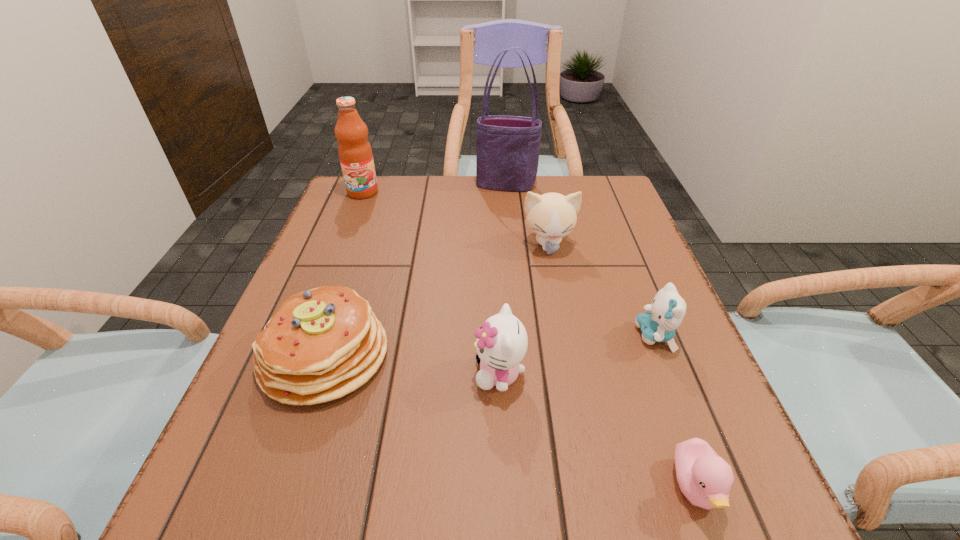
Locate an element on the screen. The image size is (960, 540). fruit juice situated at the far edge is located at coordinates (355, 153).

Where is `object that is positioned at the near edge`? The width and height of the screenshot is (960, 540). object that is positioned at the near edge is located at coordinates (705, 479).

Locate an element on the screen. This screenshot has width=960, height=540. fruit juice positioned at the left edge is located at coordinates (355, 153).

Find the location of a particular element. pancake present at the left edge is located at coordinates (322, 344).

This screenshot has height=540, width=960. I want to click on kitten that is at the right edge, so click(x=658, y=324).

This screenshot has height=540, width=960. What are the coordinates of `duckling present at the right edge` in the screenshot? It's located at (705, 479).

You are a GUI agent. You are given a task and a screenshot of the screen. Output one action in this format:
    pyautogui.click(x=<x>, y=<y>)
    Task: Click on the object present at the far left corner
    The image size is (960, 540).
    Given the screenshot: What is the action you would take?
    pyautogui.click(x=355, y=153)

Where is `object that is at the near right corner`? The height and width of the screenshot is (540, 960). object that is at the near right corner is located at coordinates (705, 479).

You are a GUI agent. You are given a task and a screenshot of the screen. Output one action in this format:
    pyautogui.click(x=<x>, y=<y>)
    Task: Click on the vacant space at the far edge
    
    Given the screenshot: What is the action you would take?
    pyautogui.click(x=545, y=187)

Locate an element on the screen. blank space at the near edge of the desktop is located at coordinates (630, 530).